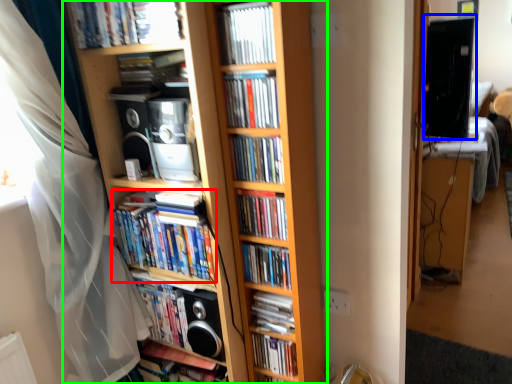
Question: Based on their relative distances, which object is nearer to book (highlighted by a red box)? Choose from computer monitor (highlighted by a blue box) and bookcase (highlighted by a green box).

Choices:
 (A) computer monitor
 (B) bookcase

Answer: (B)